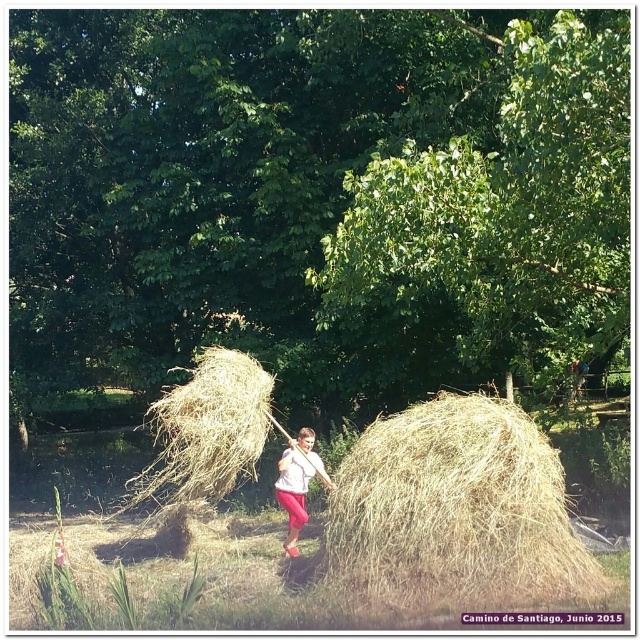
You are a farmer trying to organize your storage shed. You have a space that can only fit items wider than the pink fabric girl at center. Can the dry straw at center fit in this space?

The dry straw at center has a width larger than the pink fabric girl at center, so it cannot fit in the space since the space requires items wider than the pink fabric girl at center.

You are a farmer who needs to stack hay bales. You have a dry straw bale at center and a pink fabric girl at center in front of you. Which object should you choose to place on top of the stack to ensure stability?

The dry straw bale at center has a greater height compared to the pink fabric girl at center, so it would provide a more stable base for stacking hay bales.